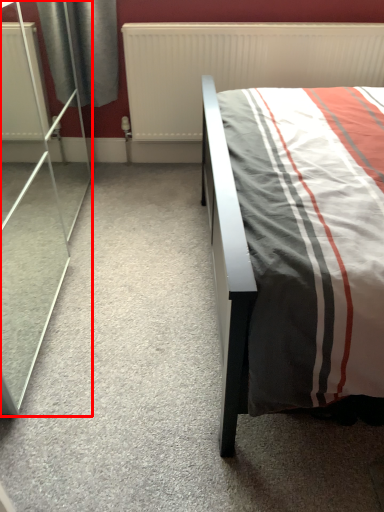
Question: From the image's perspective, what is the correct spatial positioning of screen door (annotated by the red box) in reference to radiator?

Choices:
 (A) below
 (B) above

Answer: (A)